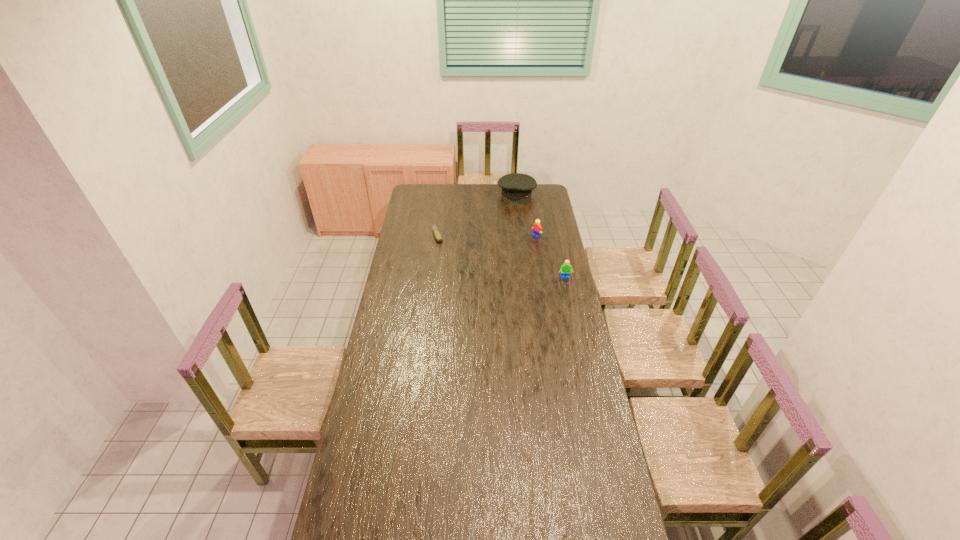
Locate an element on the screen. The height and width of the screenshot is (540, 960). the shortest object is located at coordinates click(438, 237).

Locate an element on the screen. the leftmost object is located at coordinates (438, 237).

Where is `the nearest object`? The width and height of the screenshot is (960, 540). the nearest object is located at coordinates (565, 269).

The height and width of the screenshot is (540, 960). I want to click on the rightmost object, so click(x=565, y=269).

The image size is (960, 540). What are the coordinates of `the farthest object` in the screenshot? It's located at (517, 188).

Identify the location of the left Lego. This screenshot has height=540, width=960. (537, 229).

The width and height of the screenshot is (960, 540). I want to click on free space located on the front of the pocketknife, so click(x=432, y=278).

Where is `free space located on the face of the rightmost object`? Image resolution: width=960 pixels, height=540 pixels. free space located on the face of the rightmost object is located at coordinates (575, 322).

Where is `free region located 0.270m on the front-facing side of the beret`? This screenshot has width=960, height=540. free region located 0.270m on the front-facing side of the beret is located at coordinates (510, 229).

Where is `vacant space located on the front-facing side of the beret`? This screenshot has height=540, width=960. vacant space located on the front-facing side of the beret is located at coordinates (513, 213).